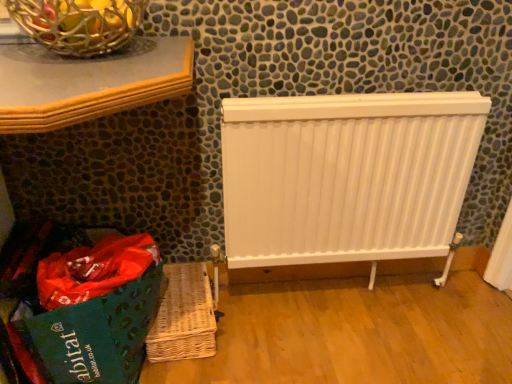
Image resolution: width=512 pixels, height=384 pixels. I want to click on vacant region in front of white matte radiator at center, so pyautogui.click(x=338, y=339).